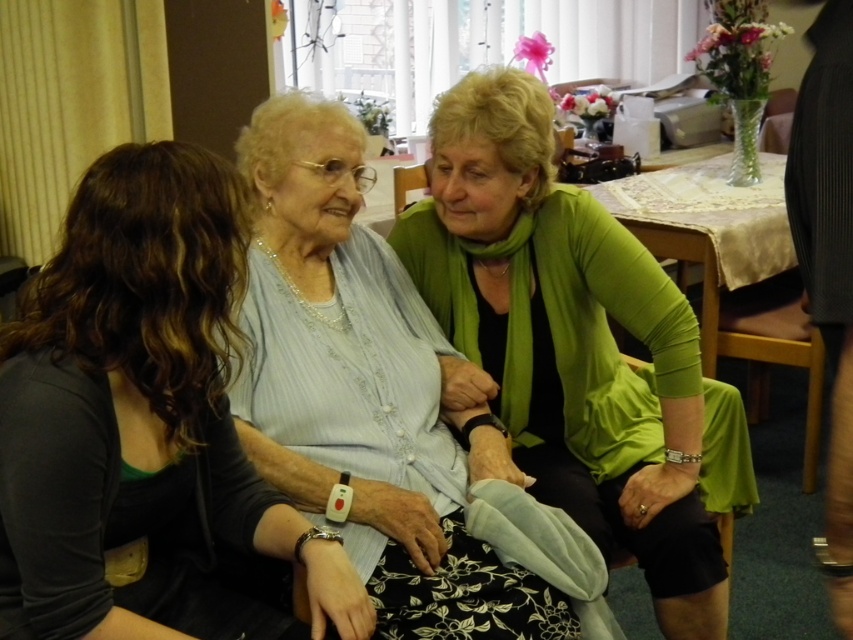
Can you confirm if green matte cardigan at center is taller than light blue fabric at center?

Yes, green matte cardigan at center is taller than light blue fabric at center.

Measure the distance between point (682, 541) and camera.

A distance of 5.38 feet exists between point (682, 541) and camera.

The height and width of the screenshot is (640, 853). In order to click on green matte cardigan at center in this screenshot , I will do `click(575, 346)`.

Between green matte cardigan at center and matte gray sweater at center, which one appears on the right side from the viewer's perspective?

From the viewer's perspective, green matte cardigan at center appears more on the right side.

Does point (672, 451) come closer to viewer compared to point (178, 212)?

No, (672, 451) is behind (178, 212).

Find the location of a particular element. This screenshot has width=853, height=640. green matte cardigan at center is located at coordinates (575, 346).

Does point (721, 556) lie behind point (427, 173)?

No, it is not.

Where is `green matte cardigan at center`? The image size is (853, 640). green matte cardigan at center is located at coordinates (575, 346).

Locate an element on the screen. Image resolution: width=853 pixels, height=640 pixels. green matte cardigan at center is located at coordinates (575, 346).